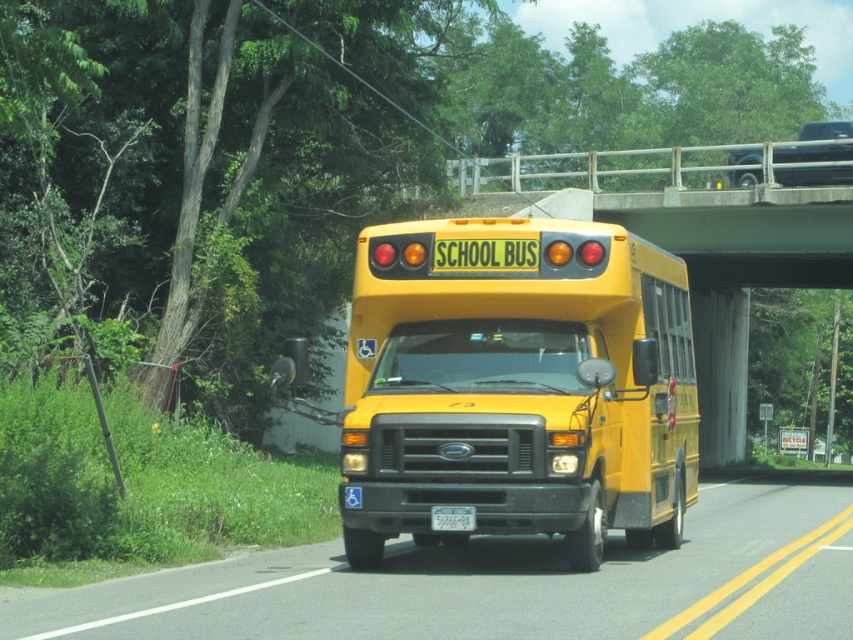
Is yellow matte school bus at center positioned behind white plastic license plate at center?

No, it is in front of white plastic license plate at center.

Can you confirm if yellow matte school bus at center is thinner than white plastic license plate at center?

No.

At what (x,y) coordinates should I click in order to perform the action: click on yellow matte school bus at center. Please return your answer as a coordinate pair (x, y). Looking at the image, I should click on (505, 586).

The width and height of the screenshot is (853, 640). Identify the location of yellow matte school bus at center. (505, 586).

Does yellow matte/solid school bus at center have a smaller size compared to yellow matte school bus at center?

Yes.

Does yellow matte/solid school bus at center have a greater width compared to yellow matte school bus at center?

No.

Which is in front, point (492, 451) or point (596, 600)?

Point (596, 600) is in front.

Identify the location of yellow matte/solid school bus at center. (517, 385).

Between yellow matte/solid school bus at center and white plastic license plate at center, which one has more height?

With more height is yellow matte/solid school bus at center.

Who is more distant from viewer, (523,296) or (462,515)?

The point (523,296) is more distant.

Locate an element on the screen. The width and height of the screenshot is (853, 640). yellow matte/solid school bus at center is located at coordinates (517, 385).